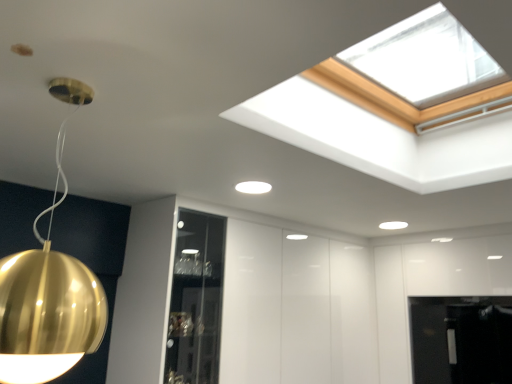
This screenshot has height=384, width=512. I want to click on white matte light fixture at upper center, the 2th lamp positioned from the top, so click(393, 225).

Measure the distance between point (392, 225) and camera.

Point (392, 225) is 3.09 meters away from camera.

This screenshot has width=512, height=384. Describe the element at coordinates (393, 225) in the screenshot. I see `white matte light fixture at upper center, which appears as the second lamp when viewed from the left` at that location.

Find the location of a particular element. gold reflective sphere at left, which appears as the 1th lamp when viewed from the left is located at coordinates 48,306.

The image size is (512, 384). What do you see at coordinates (48, 306) in the screenshot? I see `gold reflective sphere at left, marked as the first lamp in a top-to-bottom arrangement` at bounding box center [48, 306].

Locate an element on the screen. The image size is (512, 384). white matte light fixture at upper center, the first lamp when ordered from bottom to top is located at coordinates (393, 225).

Between white matte light fixture at upper center, which appears as the second lamp when viewed from the left, and gold reflective sphere at left, the second lamp from the right, which one appears on the left side from the viewer's perspective?

Positioned to the left is gold reflective sphere at left, the second lamp from the right.

Which object is closer to the camera, white matte light fixture at upper center, which appears as the second lamp when viewed from the front, or gold reflective sphere at left, marked as the first lamp in a top-to-bottom arrangement?

Positioned in front is gold reflective sphere at left, marked as the first lamp in a top-to-bottom arrangement.

Considering the points (394, 228) and (63, 121), which point is in front, point (394, 228) or point (63, 121)?

Point (63, 121)

From the image's perspective, is white matte light fixture at upper center, the 1th lamp in the back-to-front sequence, above or below gold reflective sphere at left, the second lamp from the right?

Based on their image positions, white matte light fixture at upper center, the 1th lamp in the back-to-front sequence, is located beneath gold reflective sphere at left, the second lamp from the right.

From a real-world perspective, relative to gold reflective sphere at left, the second lamp from the right, is white matte light fixture at upper center, which is the first lamp from right to left, vertically above or below?

From a real-world perspective, white matte light fixture at upper center, which is the first lamp from right to left, is physically above gold reflective sphere at left, the second lamp from the right.

Considering the relative sizes of white matte light fixture at upper center, which appears as the second lamp when viewed from the left, and gold reflective sphere at left, the 1th lamp viewed from the front, in the image provided, is white matte light fixture at upper center, which appears as the second lamp when viewed from the left, thinner than gold reflective sphere at left, the 1th lamp viewed from the front,?

Indeed, white matte light fixture at upper center, which appears as the second lamp when viewed from the left, has a lesser width compared to gold reflective sphere at left, the 1th lamp viewed from the front.

Can you confirm if white matte light fixture at upper center, the first lamp when ordered from bottom to top, is taller than gold reflective sphere at left, the 1th lamp viewed from the front?

In fact, white matte light fixture at upper center, the first lamp when ordered from bottom to top, may be shorter than gold reflective sphere at left, the 1th lamp viewed from the front.

Which of these two, white matte light fixture at upper center, the 1th lamp in the back-to-front sequence, or gold reflective sphere at left, the second lamp when ordered from bottom to top, is smaller?

With smaller size is white matte light fixture at upper center, the 1th lamp in the back-to-front sequence.

Is white matte light fixture at upper center, the 2th lamp positioned from the top, not within gold reflective sphere at left, the second lamp when ordered from bottom to top?

Yes, white matte light fixture at upper center, the 2th lamp positioned from the top, is located beyond the bounds of gold reflective sphere at left, the second lamp when ordered from bottom to top.

Is white matte light fixture at upper center, which is the first lamp from right to left, touching gold reflective sphere at left, the second lamp when ordered from back to front?

They are not placed beside each other.

Could you tell me if white matte light fixture at upper center, the 2th lamp positioned from the top, is turned towards gold reflective sphere at left, the second lamp when ordered from back to front?

No, white matte light fixture at upper center, the 2th lamp positioned from the top, is not turned towards gold reflective sphere at left, the second lamp when ordered from back to front.

What's the angular difference between white matte light fixture at upper center, the 1th lamp in the back-to-front sequence, and gold reflective sphere at left, which appears as the 1th lamp when viewed from the left,'s facing directions?

There is a 90-degree angle between the facing directions of white matte light fixture at upper center, the 1th lamp in the back-to-front sequence, and gold reflective sphere at left, which appears as the 1th lamp when viewed from the left.

In order to click on lamp above the white matte light fixture at upper center, the 2th lamp positioned from the top (from the image's perspective) in this screenshot , I will do `click(48, 306)`.

Which is more to the right, gold reflective sphere at left, the second lamp when ordered from back to front, or white matte light fixture at upper center, the first lamp when ordered from bottom to top?

Positioned to the right is white matte light fixture at upper center, the first lamp when ordered from bottom to top.

Which object is more forward, gold reflective sphere at left, marked as the first lamp in a top-to-bottom arrangement, or white matte light fixture at upper center, the 2th lamp positioned from the top?

gold reflective sphere at left, marked as the first lamp in a top-to-bottom arrangement, is closer to the camera.

Considering the points (26, 256) and (382, 226), which point is behind, point (26, 256) or point (382, 226)?

The point (382, 226) is farther.

From the image's perspective, relative to white matte light fixture at upper center, which is the first lamp from right to left, is gold reflective sphere at left, the 1th lamp viewed from the front, above or below?

Clearly, from the image's perspective, gold reflective sphere at left, the 1th lamp viewed from the front, is above white matte light fixture at upper center, which is the first lamp from right to left.

From the picture: From a real-world perspective, is gold reflective sphere at left, the second lamp when ordered from back to front, positioned above or below white matte light fixture at upper center, the 2th lamp positioned from the top?

Clearly, from a real-world perspective, gold reflective sphere at left, the second lamp when ordered from back to front, is below white matte light fixture at upper center, the 2th lamp positioned from the top.

Is gold reflective sphere at left, the 1th lamp viewed from the front, thinner than white matte light fixture at upper center, which appears as the second lamp when viewed from the front?

No.

Considering the relative sizes of gold reflective sphere at left, the 1th lamp viewed from the front, and white matte light fixture at upper center, the 1th lamp in the back-to-front sequence, in the image provided, is gold reflective sphere at left, the 1th lamp viewed from the front, taller than white matte light fixture at upper center, the 1th lamp in the back-to-front sequence,?

Indeed, gold reflective sphere at left, the 1th lamp viewed from the front, has a greater height compared to white matte light fixture at upper center, the 1th lamp in the back-to-front sequence.

Which of these two, gold reflective sphere at left, the 1th lamp viewed from the front, or white matte light fixture at upper center, the first lamp when ordered from bottom to top, is smaller?

With smaller size is white matte light fixture at upper center, the first lamp when ordered from bottom to top.

Is white matte light fixture at upper center, the first lamp when ordered from bottom to top, surrounded by gold reflective sphere at left, the second lamp when ordered from bottom to top?

No, white matte light fixture at upper center, the first lamp when ordered from bottom to top, is not a part of gold reflective sphere at left, the second lamp when ordered from bottom to top.

Does gold reflective sphere at left, marked as the first lamp in a top-to-bottom arrangement, touch white matte light fixture at upper center, the 1th lamp in the back-to-front sequence?

No, gold reflective sphere at left, marked as the first lamp in a top-to-bottom arrangement, is not making contact with white matte light fixture at upper center, the 1th lamp in the back-to-front sequence.

Is white matte light fixture at upper center, the 2th lamp positioned from the top, at the back of gold reflective sphere at left, which appears as the 1th lamp when viewed from the left?

No, gold reflective sphere at left, which appears as the 1th lamp when viewed from the left, is not facing away from white matte light fixture at upper center, the 2th lamp positioned from the top.

How far apart are gold reflective sphere at left, which appears as the 1th lamp when viewed from the left, and white matte light fixture at upper center, the first lamp when ordered from bottom to top?

gold reflective sphere at left, which appears as the 1th lamp when viewed from the left, and white matte light fixture at upper center, the first lamp when ordered from bottom to top, are 7.91 feet apart.

Where is `lamp on the left side of white matte light fixture at upper center, the 1th lamp in the back-to-front sequence`? lamp on the left side of white matte light fixture at upper center, the 1th lamp in the back-to-front sequence is located at coordinates (48, 306).

Image resolution: width=512 pixels, height=384 pixels. I want to click on lamp above the white matte light fixture at upper center, the first lamp when ordered from bottom to top (from the image's perspective), so click(48, 306).

At what (x,y) coordinates should I click in order to perform the action: click on lamp below the white matte light fixture at upper center, which appears as the second lamp when viewed from the front (from a real-world perspective). Please return your answer as a coordinate pair (x, y). Looking at the image, I should click on point(48,306).